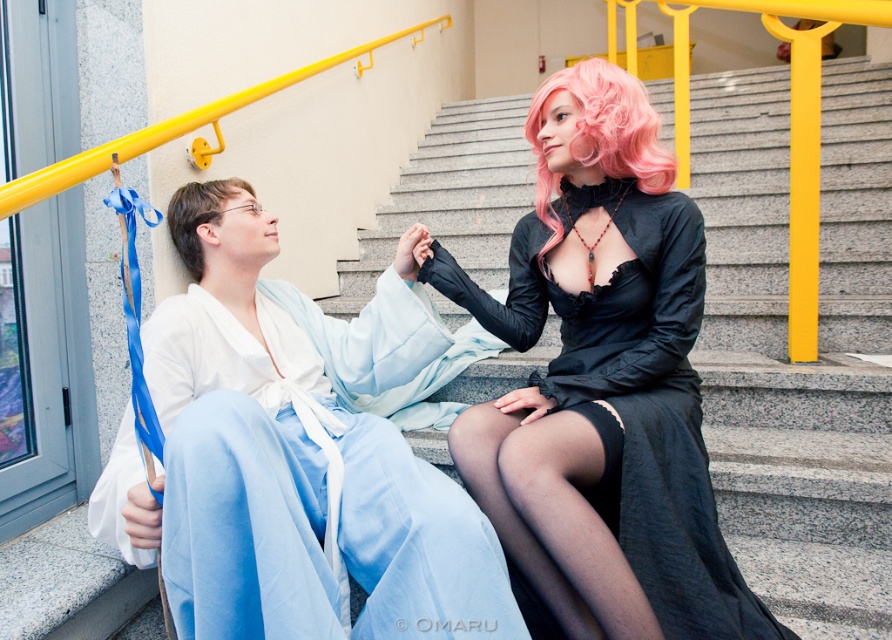
In the scene shown: Can you confirm if satin black dress at center is smaller than light blue silk robe at lower left?

Yes.

What do you see at coordinates (601, 385) in the screenshot? I see `satin black dress at center` at bounding box center [601, 385].

Measure the distance between point (560, 330) and camera.

A distance of 1.60 meters exists between point (560, 330) and camera.

You are a GUI agent. You are given a task and a screenshot of the screen. Output one action in this format:
    pyautogui.click(x=<x>, y=<y>)
    Task: Click on the satin black dress at center
    
    Given the screenshot: What is the action you would take?
    pyautogui.click(x=601, y=385)

Which is behind, point (303, 388) or point (213, 198)?

Positioned behind is point (213, 198).

Is point (451, 595) closer to camera compared to point (193, 225)?

Yes, point (451, 595) is in front of point (193, 225).

Is point (184, 564) positioned after point (190, 237)?

No, (184, 564) is in front of (190, 237).

The width and height of the screenshot is (892, 640). What are the coordinates of `light blue silk robe at lower left` in the screenshot? It's located at (395, 460).

Can you confirm if light blue silk robe at lower left is thinner than pink curly wig at upper right?

In fact, light blue silk robe at lower left might be wider than pink curly wig at upper right.

What do you see at coordinates (395, 460) in the screenshot?
I see `light blue silk robe at lower left` at bounding box center [395, 460].

Does point (172, 316) come in front of point (544, 253)?

Yes.

This screenshot has width=892, height=640. Identify the location of light blue silk robe at lower left. click(x=395, y=460).